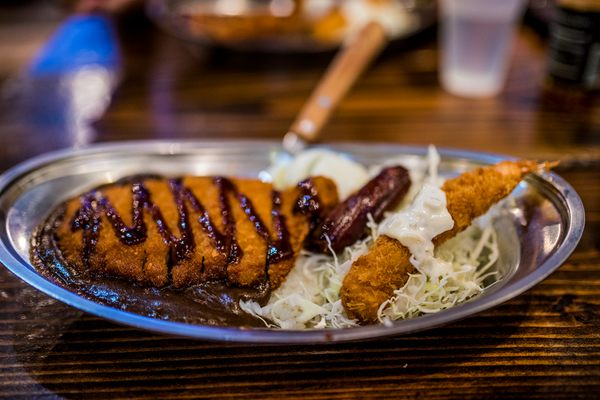
This screenshot has height=400, width=600. In order to click on glass of water in this screenshot , I will do `click(478, 32)`.